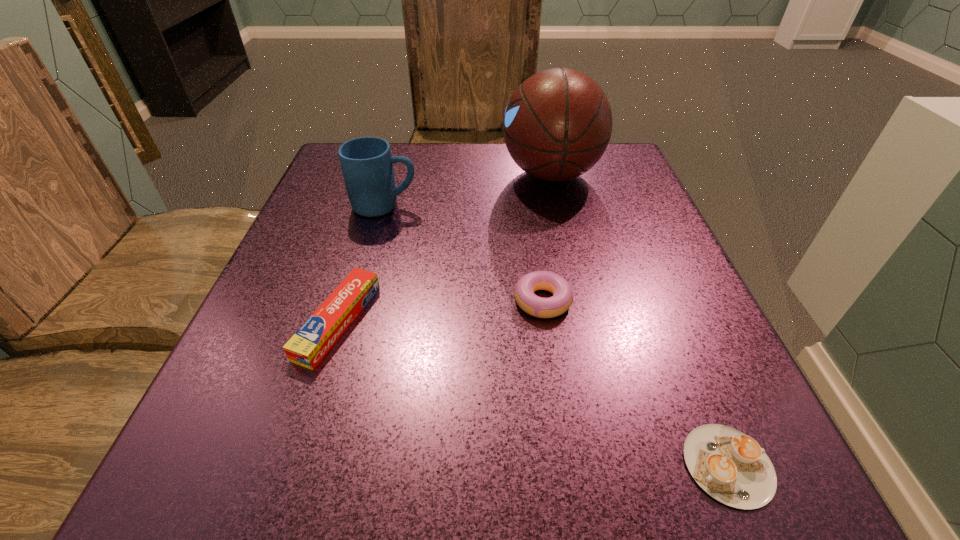
At what (x,y) coordinates should I click in order to perform the action: click on the tallest object. Please return your answer as a coordinate pair (x, y). The width and height of the screenshot is (960, 540). Looking at the image, I should click on (557, 125).

The height and width of the screenshot is (540, 960). Identify the location of the fourth shortest object. point(367,164).

This screenshot has width=960, height=540. What are the coordinates of `toothpaste` in the screenshot? It's located at (307, 347).

Where is `doughnut`? This screenshot has width=960, height=540. doughnut is located at coordinates (562, 298).

Identify the location of the shortest object. (731, 467).

Where is `cappuccino`? cappuccino is located at coordinates (731, 467).

This screenshot has height=540, width=960. I want to click on vacant region located on the front of the tallest object, so [572, 267].

The image size is (960, 540). I want to click on vacant space situated 0.090m on the side of the second tallest object with the handle, so pyautogui.click(x=463, y=206).

Locate an element on the screen. The width and height of the screenshot is (960, 540). free space located on the left of the toothpaste is located at coordinates (258, 321).

Where is `vacant region located on the front of the doughnut`? This screenshot has width=960, height=540. vacant region located on the front of the doughnut is located at coordinates (552, 366).